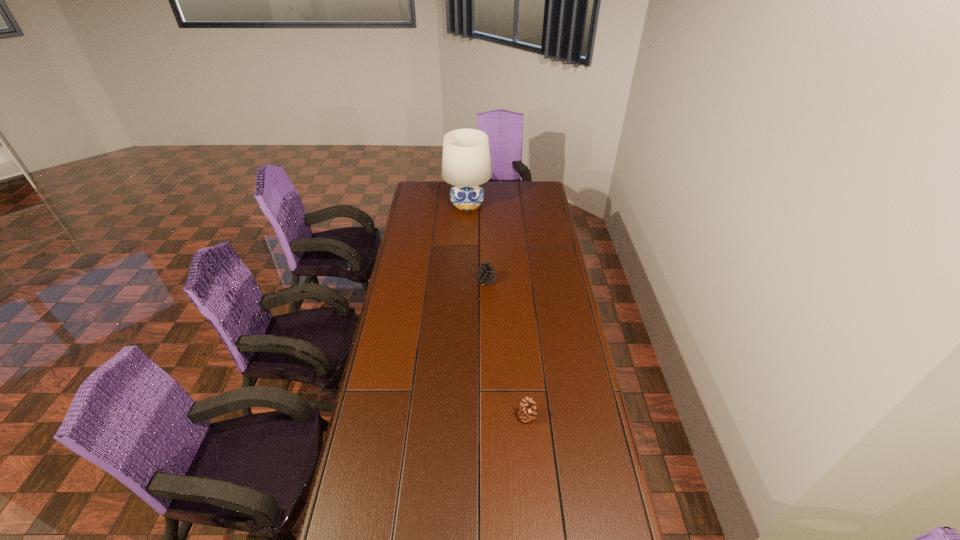
You are a GUI agent. You are given a task and a screenshot of the screen. Output one action in this format:
    pyautogui.click(x=<x>, y=<y>)
    Task: Click on the empty space between the rightmost object and the left pinecone
    The image size is (960, 540).
    Given the screenshot: What is the action you would take?
    pyautogui.click(x=507, y=349)

Identify the location of empty location between the farthest object and the farther pinecone. The width and height of the screenshot is (960, 540). (477, 243).

Locate an element on the screen. vacant region between the farther pinecone and the right pinecone is located at coordinates (507, 349).

Identify the location of free space between the rightmost object and the lampshade. This screenshot has height=540, width=960. (497, 311).

Locate an element on the screen. free spot between the farthest object and the right pinecone is located at coordinates (497, 311).

Locate which object ranks second in proximity to the farther pinecone. Please provide its 2D coordinates. Your answer should be formatted as a tuple, i.e. [(x, y)], where the tuple contains the x and y coordinates of a point satisfying the conditions above.

[(526, 412)]

Choose which object is the second nearest neighbor to the second nearest object. Please provide its 2D coordinates. Your answer should be formatted as a tuple, i.e. [(x, y)], where the tuple contains the x and y coordinates of a point satisfying the conditions above.

[(526, 412)]

At what (x,y) coordinates should I click in order to perform the action: click on vacant space that satisfies the following two spatial constraints: 1. on the front-facing side of the farthest object; 2. on the left side of the right pinecone. Please return your answer as a coordinate pair (x, y). This screenshot has height=540, width=960. Looking at the image, I should click on (459, 417).

Find the location of `vacant region that satisfies the following two spatial constraints: 1. on the front-facing side of the rightmost object; 2. on the left side of the farthest object`. vacant region that satisfies the following two spatial constraints: 1. on the front-facing side of the rightmost object; 2. on the left side of the farthest object is located at coordinates (459, 417).

Locate an element on the screen. Image resolution: width=960 pixels, height=540 pixels. free location that satisfies the following two spatial constraints: 1. on the front-facing side of the rightmost object; 2. on the left side of the farthest object is located at coordinates (459, 417).